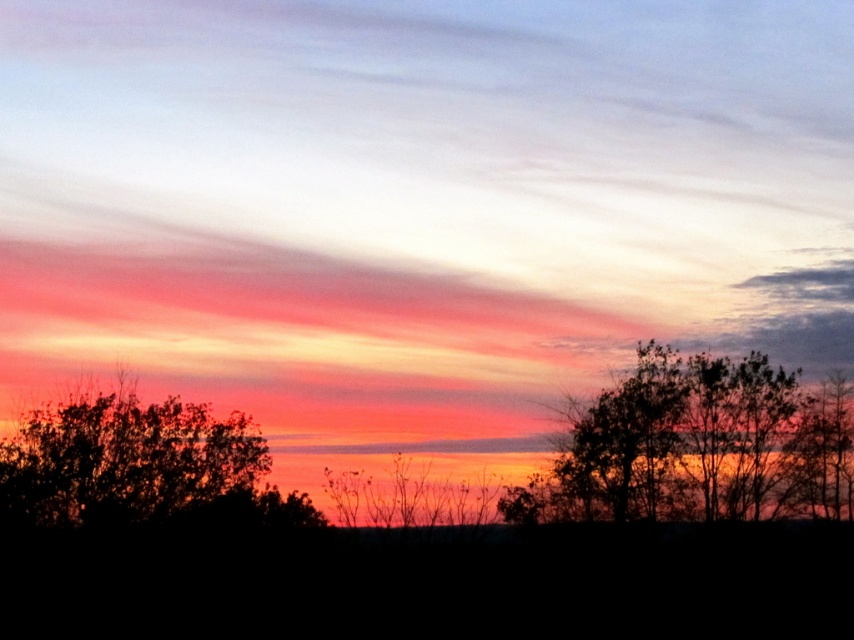
Can you confirm if silhouette leafy tree at right is positioned to the right of silhouette tree at left?

Indeed, silhouette leafy tree at right is positioned on the right side of silhouette tree at left.

The image size is (854, 640). I want to click on silhouette leafy tree at right, so click(x=699, y=445).

Image resolution: width=854 pixels, height=640 pixels. What do you see at coordinates (699, 445) in the screenshot?
I see `silhouette leafy tree at right` at bounding box center [699, 445].

Where is `silhouette leafy tree at right`? silhouette leafy tree at right is located at coordinates (699, 445).